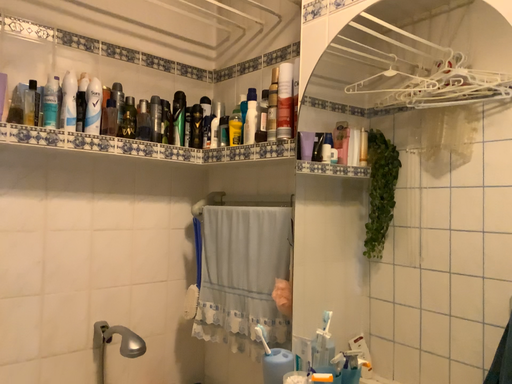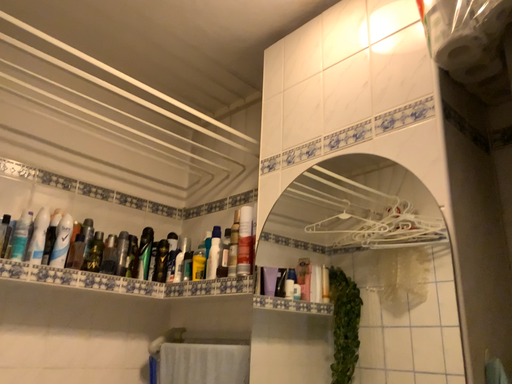
Question: Which way did the camera rotate in the video?

Choices:
 (A) rotated downward
 (B) rotated upward

Answer: (B)